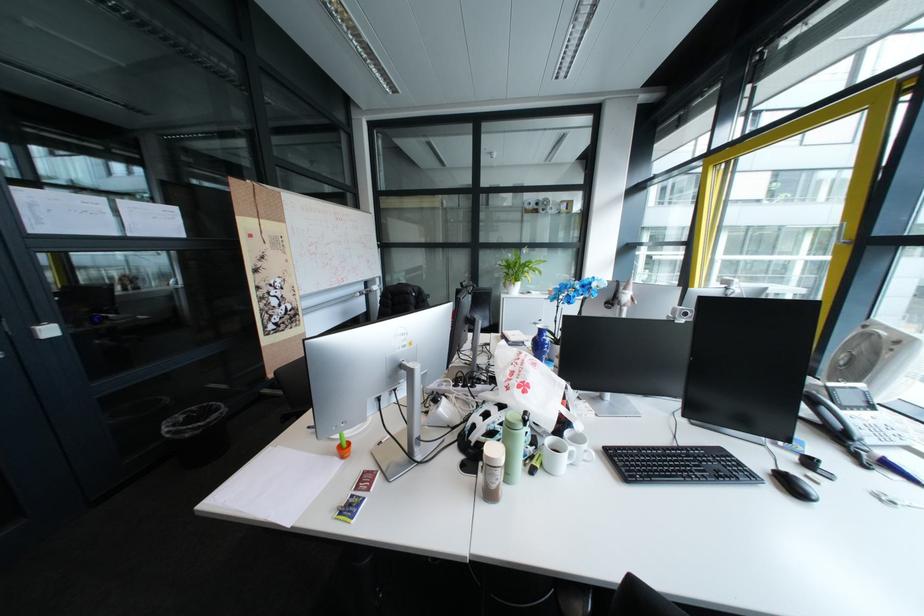
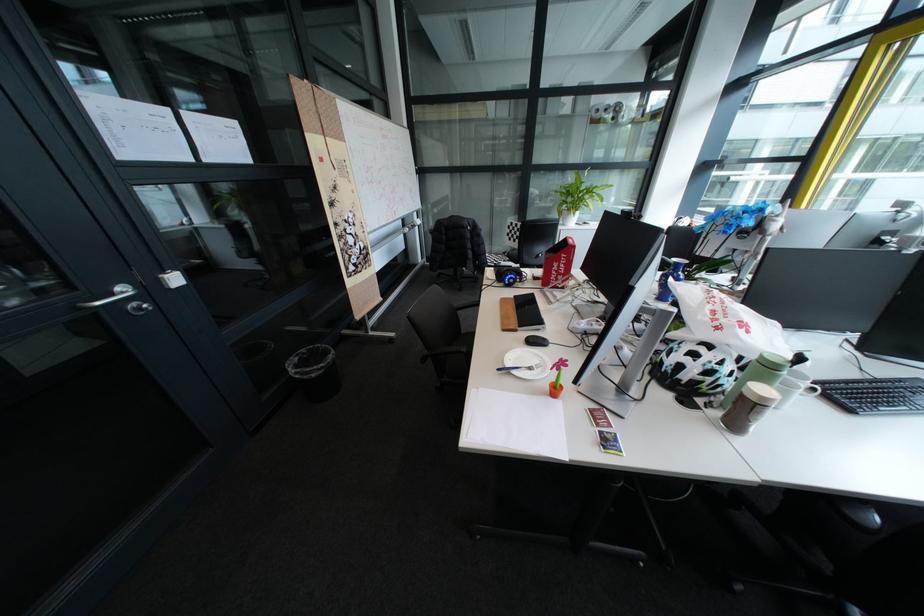
The point at (584, 448) is marked in the first image. Where is the corresponding point in the second image?

(815, 386)